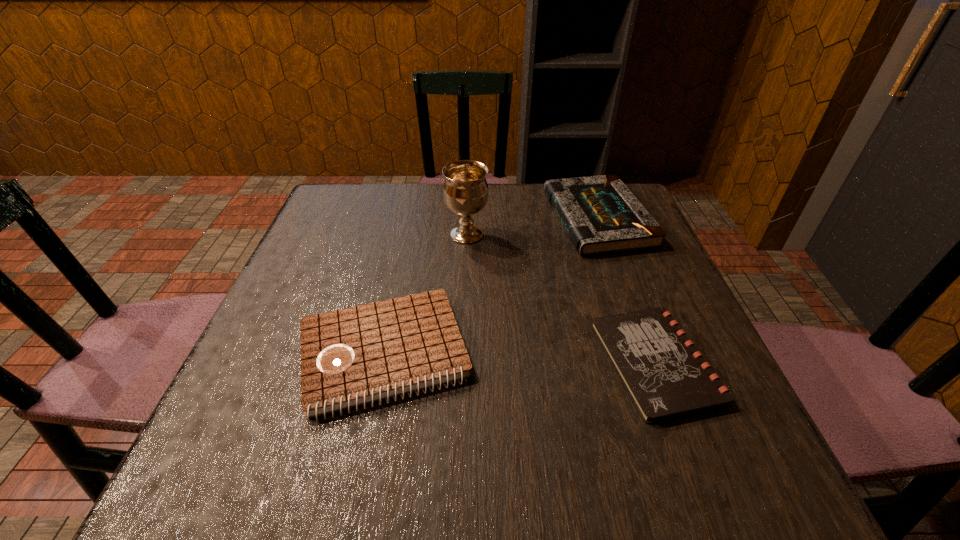
Identify which notebook is located as the nearest to the shortest object. Please provide its 2D coordinates. Your answer should be formatted as a tuple, i.e. [(x, y)], where the tuple contains the x and y coordinates of a point satisfying the conditions above.

[(601, 215)]

Choose which notebook is the nearest neighbor to the shortest notebook. Please provide its 2D coordinates. Your answer should be formatted as a tuple, i.e. [(x, y)], where the tuple contains the x and y coordinates of a point satisfying the conditions above.

[(601, 215)]

You are a GUI agent. You are given a task and a screenshot of the screen. Output one action in this format:
    pyautogui.click(x=<x>, y=<y>)
    Task: Click on the vacant region that satisfies the following two spatial constraints: 1. on the back side of the second tallest object; 2. on the right side of the tallest object
    The width and height of the screenshot is (960, 540).
    Given the screenshot: What is the action you would take?
    pyautogui.click(x=468, y=219)

Where is `free spot that satisfies the following two spatial constraints: 1. on the front side of the shortest object; 2. on the right side of the third tallest object`? The image size is (960, 540). free spot that satisfies the following two spatial constraints: 1. on the front side of the shortest object; 2. on the right side of the third tallest object is located at coordinates (382, 362).

Locate an element on the screen. This screenshot has width=960, height=540. free spot that satisfies the following two spatial constraints: 1. on the front side of the tallest object; 2. on the right side of the shortest object is located at coordinates (462, 362).

The width and height of the screenshot is (960, 540). Identify the location of vacant space that satisfies the following two spatial constraints: 1. on the front side of the shortest notebook; 2. on the left side of the tallest object. (462, 362).